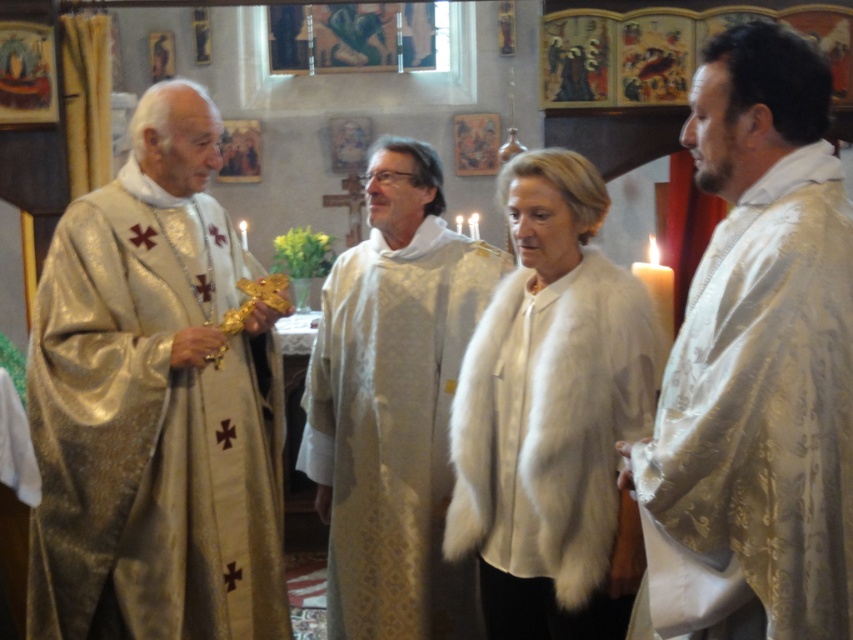
You are standing in the church and want to take a photo of both the point at location (167,596) and the point at (700,362). Which point should you focus on first to ensure both are in clear view?

You should focus on point (167,596) first because it is closer to the camera than point (700,362). This way, adjusting the focus from near to far will help both points be in clear view.

In the religious ceremony scene, there are two notable items worn by the clergy members. The shiny gold robe at left and the white fur coat at center. Which of these two items is bigger in size?

The shiny gold robe at left is larger in size compared to the white fur coat at center.